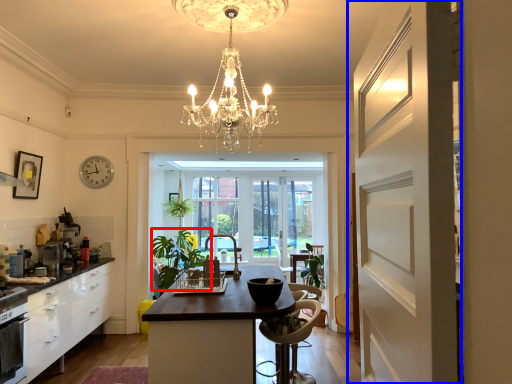
Question: Which object appears farthest to the camera in this image, plant (highlighted by a red box) or door (highlighted by a blue box)?

Choices:
 (A) plant
 (B) door

Answer: (A)